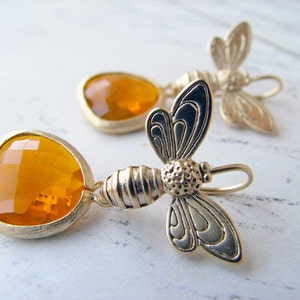
This screenshot has width=300, height=300. Find the location of `amber glass`. amber glass is located at coordinates (0, 11), (40, 193), (119, 93).